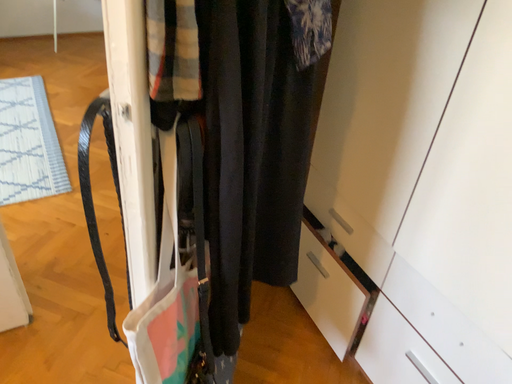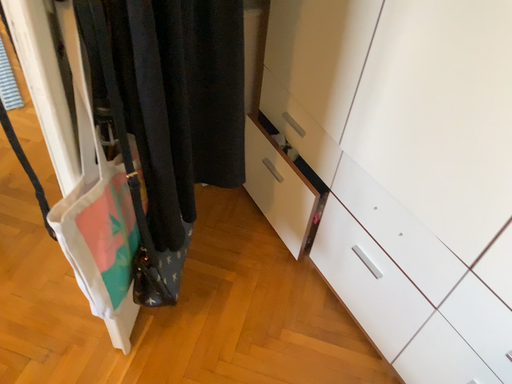
Question: Which way did the camera rotate in the video?

Choices:
 (A) rotated upward
 (B) rotated downward

Answer: (B)